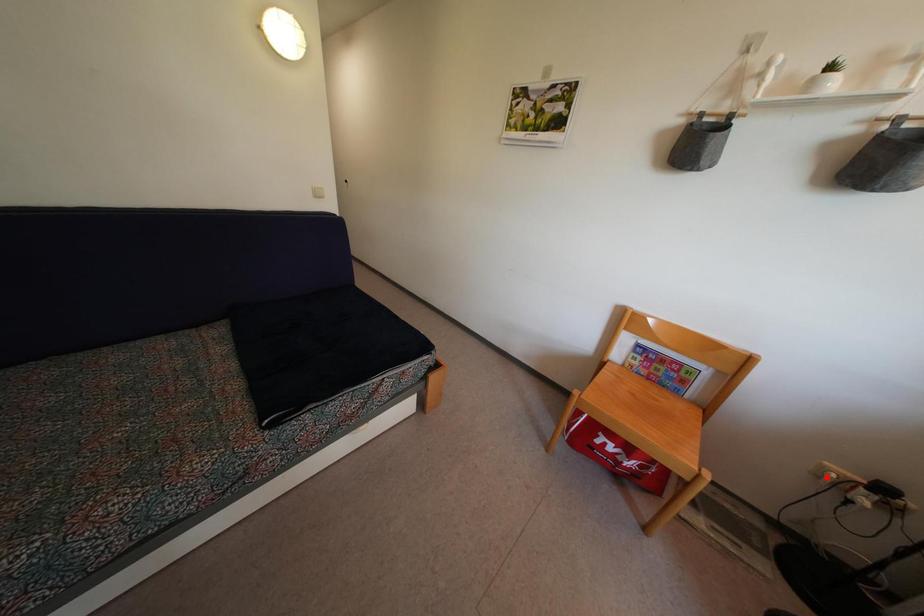
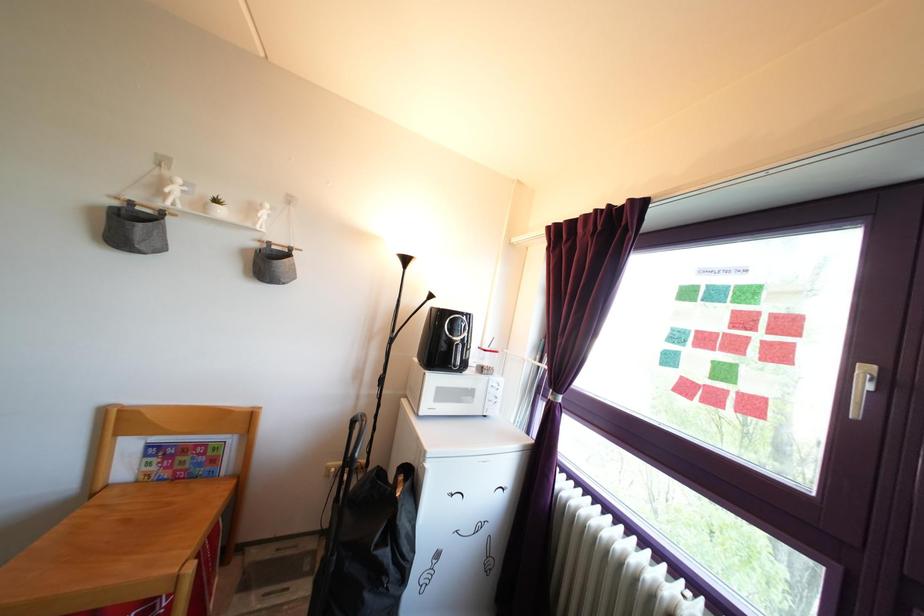
Locate, in the second image, the point that corresponds to the highlighted location in the first image.

(332, 477)